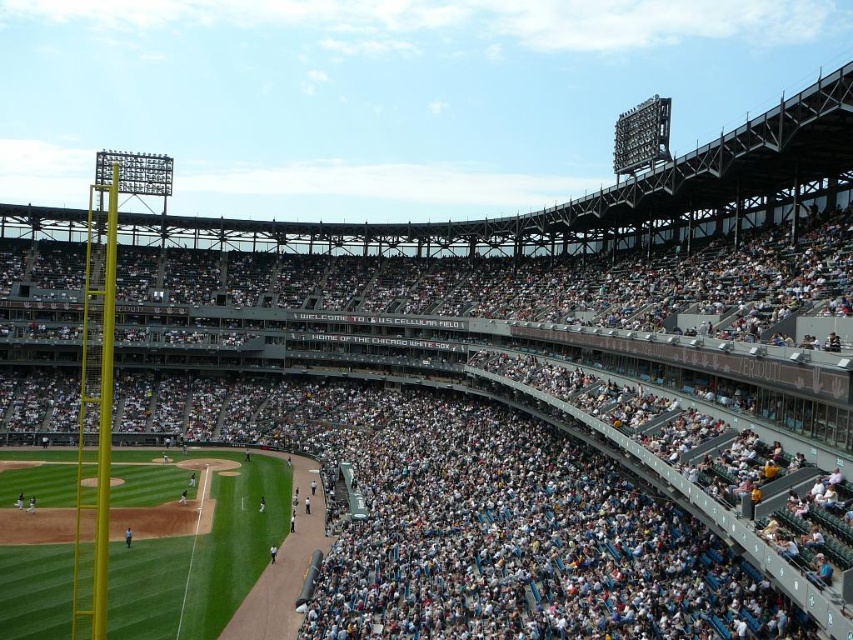
Question: Considering the relative positions of metallic silver baseball team at center and light brown leather glove at lower left in the image provided, where is metallic silver baseball team at center located with respect to light brown leather glove at lower left?

Choices:
 (A) right
 (B) left

Answer: (A)

Question: Which object is farther from the camera taking this photo?

Choices:
 (A) light brown leather glove at lower left
 (B) metallic silver baseball team at center

Answer: (A)

Question: From the image, what is the correct spatial relationship of metallic silver baseball team at center in relation to light brown leather glove at lower left?

Choices:
 (A) left
 (B) right

Answer: (B)

Question: Which point is farther to the camera?

Choices:
 (A) (367, 368)
 (B) (131, 536)

Answer: (A)

Question: In this image, where is metallic silver baseball team at center located relative to light brown leather glove at lower left?

Choices:
 (A) above
 (B) below

Answer: (A)